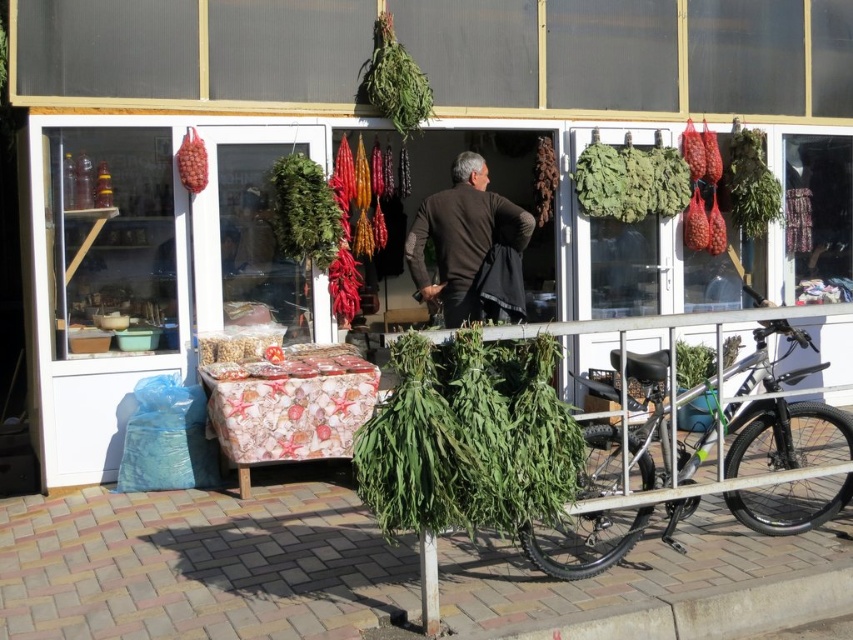
Can you confirm if green leafy vegetables at upper right is positioned below matte red grapes at upper left?

Yes, green leafy vegetables at upper right is below matte red grapes at upper left.

In the scene shown: Between green leafy vegetables at upper right and matte red grapes at upper left, which one is positioned lower?

green leafy vegetables at upper right is lower down.

Who is more forward, (665, 168) or (195, 188)?

Positioned in front is point (195, 188).

Where is `green leafy vegetables at upper right`? The height and width of the screenshot is (640, 853). green leafy vegetables at upper right is located at coordinates (630, 180).

Is silver metallic bicycle at lower right positioned behind green leafy vegetables at upper right?

No, it is not.

Measure the distance between silver metallic bicycle at lower right and green leafy vegetables at upper right.

silver metallic bicycle at lower right is 7.06 feet from green leafy vegetables at upper right.

Find the location of a particular element. The image size is (853, 640). silver metallic bicycle at lower right is located at coordinates (782, 433).

Which is more to the right, brown woolen jacket at center or green leafy vegetables at upper right?

Positioned to the right is green leafy vegetables at upper right.

Is brown woolen jacket at center behind green leafy vegetables at upper right?

No, it is in front of green leafy vegetables at upper right.

Image resolution: width=853 pixels, height=640 pixels. Identify the location of brown woolen jacket at center. (463, 240).

The image size is (853, 640). I want to click on brown woolen jacket at center, so click(463, 240).